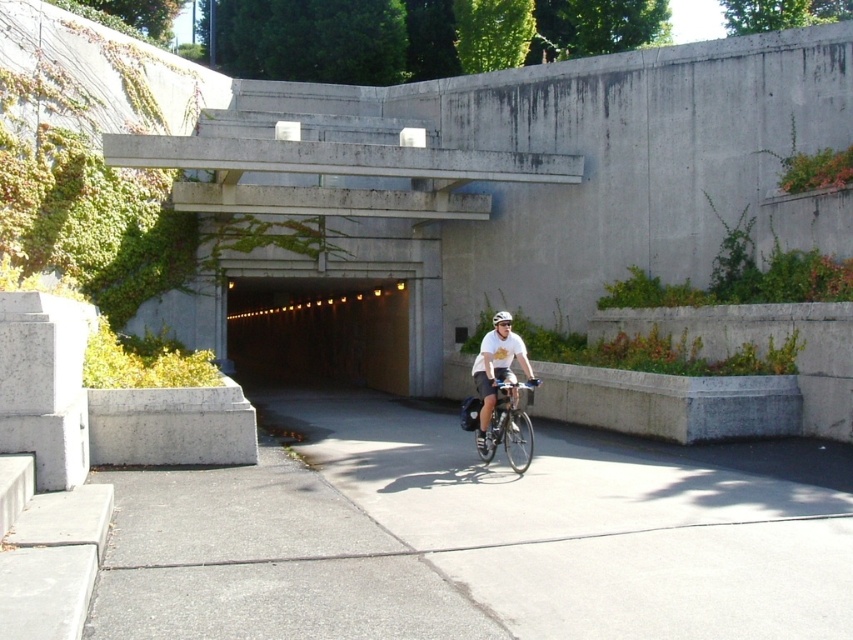
Can you confirm if silver metallic bicycle at center is taller than white matte shirt at center?

Indeed, silver metallic bicycle at center has a greater height compared to white matte shirt at center.

Can you confirm if silver metallic bicycle at center is positioned above white matte shirt at center?

No.

The width and height of the screenshot is (853, 640). In order to click on silver metallic bicycle at center in this screenshot , I will do `click(505, 422)`.

Consider the image. Does white matte shirt at center lie in front of white matte bicycle helmet at center?

That is False.

Does white matte shirt at center appear over white matte bicycle helmet at center?

Actually, white matte shirt at center is below white matte bicycle helmet at center.

Identify the location of white matte shirt at center. The height and width of the screenshot is (640, 853). (x=496, y=372).

Based on the photo, which is more to the right, silver metallic bicycle at center or white matte bicycle helmet at center?

white matte bicycle helmet at center is more to the right.

Is point (508, 426) closer to viewer compared to point (495, 323)?

Yes, point (508, 426) is closer to viewer.

At what (x,y) coordinates should I click in order to perform the action: click on silver metallic bicycle at center. Please return your answer as a coordinate pair (x, y). Looking at the image, I should click on (505, 422).

This screenshot has height=640, width=853. I want to click on silver metallic bicycle at center, so click(505, 422).